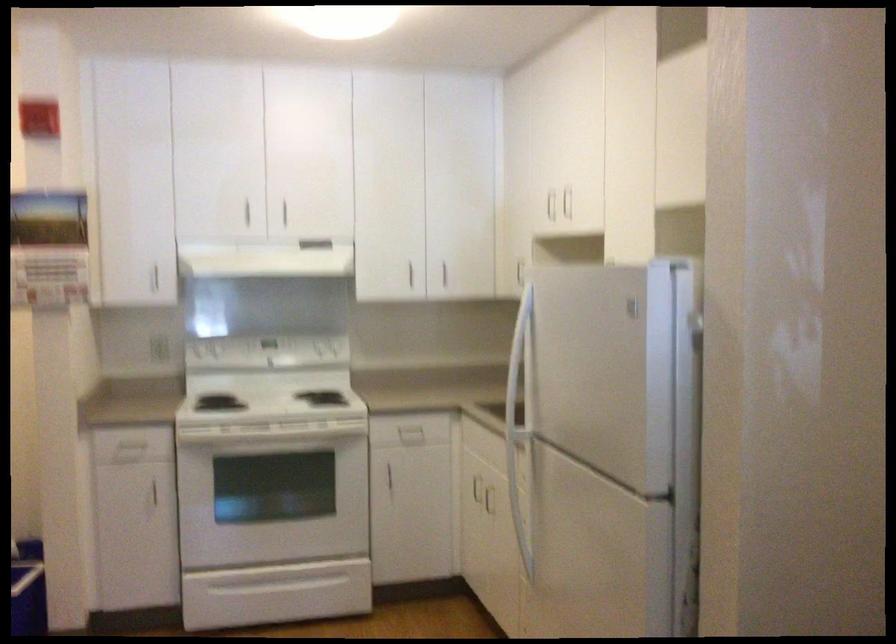
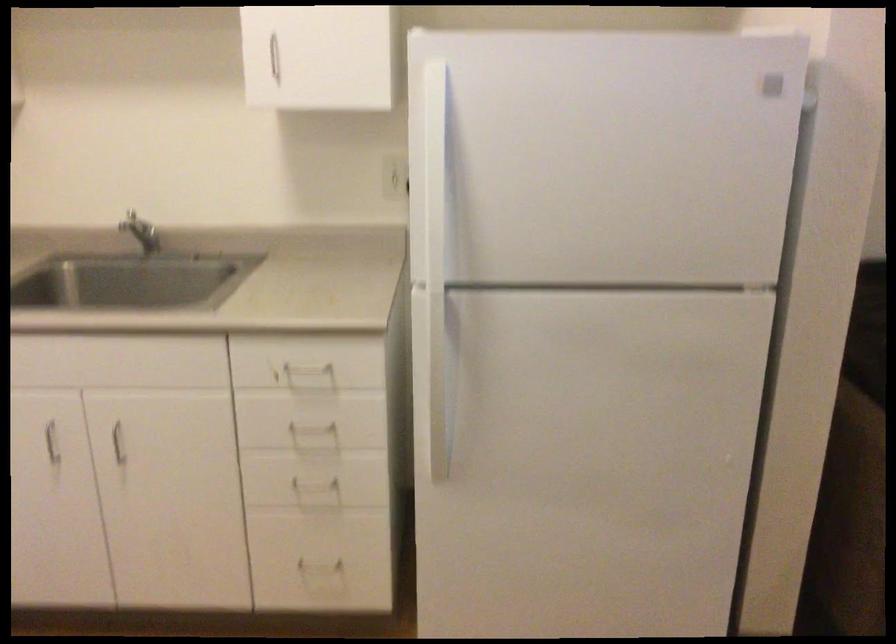
Where in the second image is the point corresponding to (x=488, y=488) from the first image?

(116, 430)